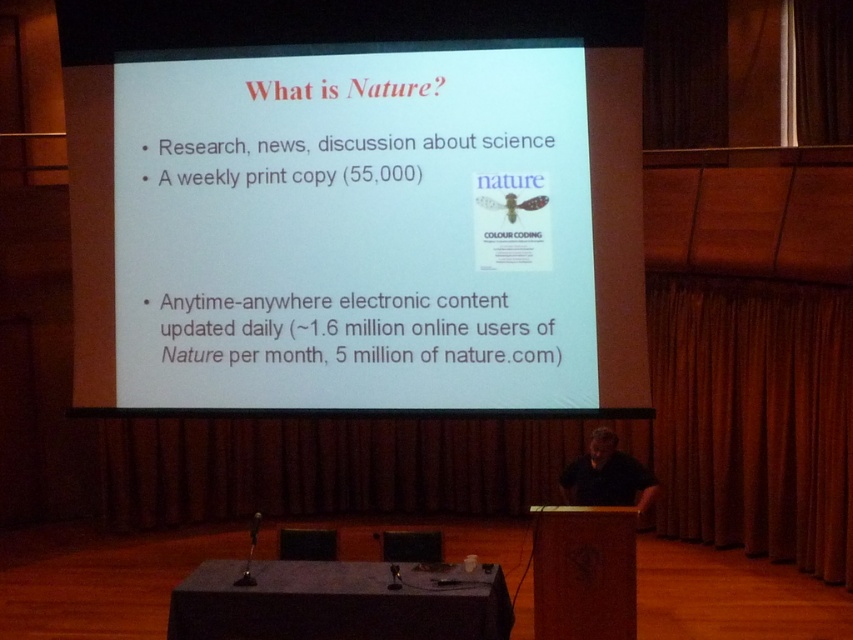
Is the position of white paper at center more distant than that of black shirt at center?

That is False.

The image size is (853, 640). What are the coordinates of `white paper at center` in the screenshot? It's located at [x=355, y=230].